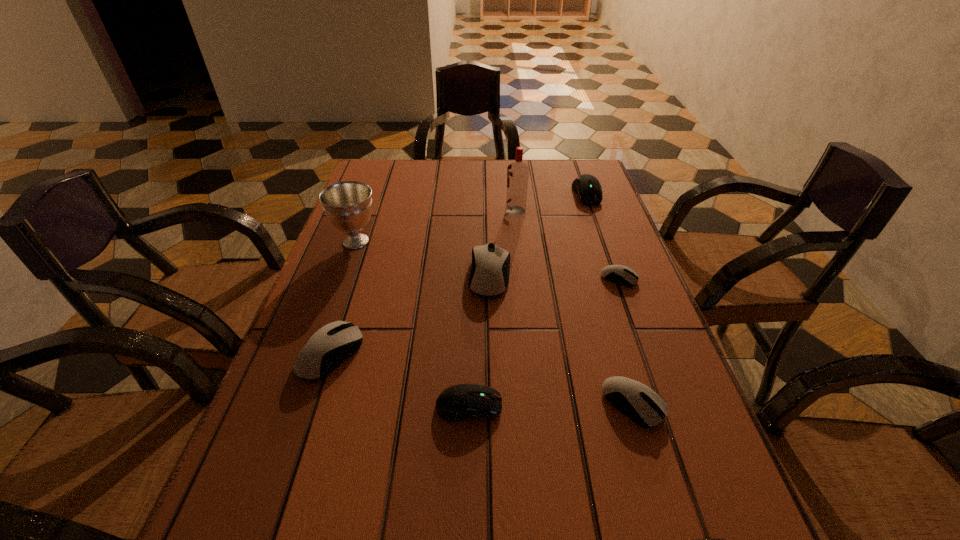
Find the location of a particular element. The height and width of the screenshot is (540, 960). vacant region located 0.380m on the back of the second smallest white mouse is located at coordinates (589, 256).

This screenshot has width=960, height=540. Identify the location of vacant region located 0.070m on the button of the leftmost dark computer equipment. (540, 406).

Locate an element on the screen. vacant space located on the back of the smallest white mouse is located at coordinates (588, 194).

This screenshot has height=540, width=960. What are the coordinates of `object present at the far edge` in the screenshot? It's located at (587, 187).

The width and height of the screenshot is (960, 540). I want to click on chalice that is at the left edge, so click(348, 205).

Locate an element on the screen. This screenshot has height=540, width=960. mouse present at the left edge is located at coordinates (333, 343).

Identify the location of object that is at the far right corner. This screenshot has height=540, width=960. (587, 187).

The image size is (960, 540). I want to click on vacant area at the far edge, so click(492, 165).

Locate an element on the screen. This screenshot has width=960, height=540. blank area at the left edge is located at coordinates (322, 391).

The height and width of the screenshot is (540, 960). In the image, there is a desktop. What are the coordinates of `free space at the right edge` in the screenshot? It's located at (636, 265).